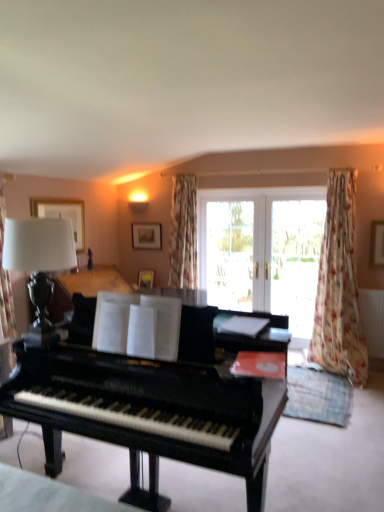
Question: Is matte black lamp at left at the back of white glass doors at center?

Choices:
 (A) no
 (B) yes

Answer: (A)

Question: Considering the relative sizes of white glass doors at center and matte black lamp at left in the image provided, is white glass doors at center bigger than matte black lamp at left?

Choices:
 (A) no
 (B) yes

Answer: (B)

Question: Is white glass doors at center located outside matte black lamp at left?

Choices:
 (A) yes
 (B) no

Answer: (A)

Question: From a real-world perspective, is white glass doors at center positioned over matte black lamp at left based on gravity?

Choices:
 (A) yes
 (B) no

Answer: (B)

Question: Is white glass doors at center positioned behind matte black lamp at left?

Choices:
 (A) no
 (B) yes

Answer: (B)

Question: Would you say white glass doors at center is a long distance from matte black lamp at left?

Choices:
 (A) yes
 (B) no

Answer: (A)

Question: From a real-world perspective, is transparent glass screen door at center, the first screen door from the left, on top of shiny black piano at center?

Choices:
 (A) no
 (B) yes

Answer: (B)

Question: Does transparent glass screen door at center, the first screen door from the left, have a greater height compared to shiny black piano at center?

Choices:
 (A) yes
 (B) no

Answer: (A)

Question: Does transparent glass screen door at center, the first screen door from the left, have a greater width compared to shiny black piano at center?

Choices:
 (A) yes
 (B) no

Answer: (B)

Question: Does transparent glass screen door at center, the first screen door from the left, appear on the right side of shiny black piano at center?

Choices:
 (A) no
 (B) yes

Answer: (B)

Question: From the image's perspective, is transparent glass screen door at center, the second screen door from the right, over shiny black piano at center?

Choices:
 (A) yes
 (B) no

Answer: (A)

Question: Is transparent glass screen door at center, the second screen door from the right, looking in the opposite direction of shiny black piano at center?

Choices:
 (A) no
 (B) yes

Answer: (A)

Question: Is white glass doors at center bigger than transparent glass screen door at center, which is counted as the first screen door, starting from the right?

Choices:
 (A) yes
 (B) no

Answer: (A)